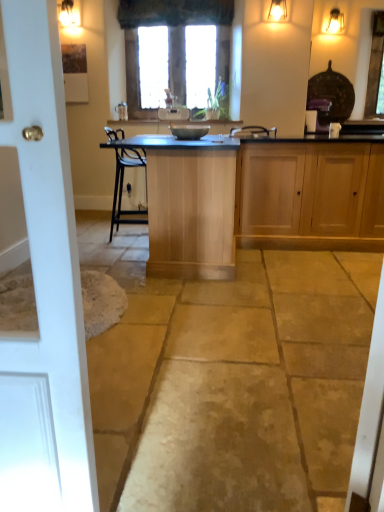
Measure the distance between point (x=340, y=31) and camera.

Point (x=340, y=31) and camera are 15.70 feet apart.

The image size is (384, 512). What do you see at coordinates (335, 22) in the screenshot? I see `matte gold light fixture at upper right` at bounding box center [335, 22].

Image resolution: width=384 pixels, height=512 pixels. What do you see at coordinates (310, 196) in the screenshot?
I see `light wood cabinet at right` at bounding box center [310, 196].

Where is `white wood door at left`? white wood door at left is located at coordinates (45, 289).

This screenshot has height=512, width=384. Describe the element at coordinates (229, 379) in the screenshot. I see `natural stone floor at center` at that location.

Identify the location of matte silver faucet at center. This screenshot has width=384, height=512. click(122, 111).

Measure the distance between point (217, 12) and camera.

The distance of point (217, 12) from camera is 5.87 meters.

Describe the element at coordinates (189, 204) in the screenshot. The height and width of the screenshot is (512, 384). I see `light wood table at center` at that location.

Find the location of a particular element. The height and width of the screenshot is (512, 384). matte gold light fixture at upper right is located at coordinates (335, 22).

Between matte silver faucet at center and light wood table at center, which one has less height?

Standing shorter between the two is matte silver faucet at center.

From the picture: Does matte silver faucet at center lie in front of light wood table at center?

No, matte silver faucet at center is behind light wood table at center.

Which object is thinner, matte silver faucet at center or light wood table at center?

With smaller width is matte silver faucet at center.

Is natural stone floor at center oriented towards light wood cabinet at right?

No, natural stone floor at center is not oriented towards light wood cabinet at right.

Which is more to the right, natural stone floor at center or light wood cabinet at right?

light wood cabinet at right.

Considering the sizes of objects natural stone floor at center and light wood cabinet at right in the image provided, who is taller, natural stone floor at center or light wood cabinet at right?

light wood cabinet at right.

In order to click on cabinetry that appears above the natural stone floor at center (from a real-world perspective) in this screenshot , I will do `click(310, 196)`.

Is white wood door at left aimed at light wood table at center?

Yes, white wood door at left is oriented towards light wood table at center.

In the image, is white wood door at left positioned in front of or behind light wood table at center?

Clearly, white wood door at left is in front of light wood table at center.

From a real-world perspective, between white wood door at left and light wood table at center, who is vertically higher?

white wood door at left is physically above.

From their relative heights in the image, would you say matte silver faucet at center is taller or shorter than natural stone floor at center?

Clearly, matte silver faucet at center is taller compared to natural stone floor at center.

From the image's perspective, which is above, matte silver faucet at center or natural stone floor at center?

matte silver faucet at center is shown above in the image.

From a real-world perspective, which object stands above the other?

matte silver faucet at center, from a real-world perspective.

You are a GUI agent. You are given a task and a screenshot of the screen. Output one action in this format:
    pyautogui.click(x=<x>, y=<y>)
    Task: Click on the faucet above the natural stone floor at center (from a real-world perspective)
    Image resolution: width=384 pixels, height=512 pixels.
    Given the screenshot: What is the action you would take?
    pyautogui.click(x=122, y=111)

Would you say matte silver faucet at center is outside matte black appliance at center?

Yes.

Could you tell me if matte silver faucet at center is facing matte black appliance at center?

No.

What are the coordinates of `faucet on the left of matte black appliance at center` in the screenshot? It's located at coord(122,111).

Would you say matte silver faucet at center is a long distance from matte black appliance at center?

Absolutely, matte silver faucet at center is distant from matte black appliance at center.

Considering the sizes of objects matte black appliance at center and white wood door at left in the image provided, who is smaller, matte black appliance at center or white wood door at left?

Smaller between the two is matte black appliance at center.

Could you tell me if matte black appliance at center is facing white wood door at left?

No, matte black appliance at center is not aimed at white wood door at left.

You are a GUI agent. You are given a task and a screenshot of the screen. Output one action in this format:
    pyautogui.click(x=<x>, y=<y>)
    Task: Click on the appliance behind the white wood door at left
    This screenshot has height=512, width=384.
    Given the screenshot: What is the action you would take?
    pyautogui.click(x=189, y=131)

Is the depth of matte black appliance at center greater than that of white wood door at left?

Yes, it is behind white wood door at left.

From the image's perspective, between white wood door at left and natural stone floor at center, which one is located above?

From the image's view, natural stone floor at center is above.

Can you confirm if white wood door at left is thinner than natural stone floor at center?

→ Indeed, white wood door at left has a lesser width compared to natural stone floor at center.

Is white wood door at left not inside natural stone floor at center?

white wood door at left lies outside natural stone floor at center's area.

Considering the relative sizes of white wood door at left and natural stone floor at center in the image provided, is white wood door at left taller than natural stone floor at center?

Indeed, white wood door at left has a greater height compared to natural stone floor at center.

You are a GUI agent. You are given a task and a screenshot of the screen. Output one action in this format:
    pyautogui.click(x=<x>, y=<y>)
    Task: Click on the faucet behind the light wood table at center
    The width and height of the screenshot is (384, 512).
    Given the screenshot: What is the action you would take?
    pyautogui.click(x=122, y=111)

You are a GUI agent. You are given a task and a screenshot of the screen. Output one action in this format:
    pyautogui.click(x=<x>, y=<y>)
    Task: Click on the cabinetry above the natural stone floor at center (from the image's perspective)
    This screenshot has height=512, width=384.
    Given the screenshot: What is the action you would take?
    pyautogui.click(x=310, y=196)

Considering their positions, is matte gold light fixture at upper right positioned closer to natural stone floor at center than matte black appliance at center?

matte black appliance at center.

When comparing their distances from matte black appliance at center, does light wood table at center or white wood door at left seem further?

white wood door at left is positioned further to the anchor matte black appliance at center.

Based on their spatial positions, is matte black appliance at center or matte gold light fixture at upper right further from light wood table at center?

matte gold light fixture at upper right is positioned further to the anchor light wood table at center.

From the image, which object appears to be nearer to natural stone floor at center, light wood table at center or matte black appliance at center?

light wood table at center is closer to natural stone floor at center.

From the image, which object appears to be farther from natural stone floor at center, light wood cabinet at right or white wood door at left?

The object further to natural stone floor at center is light wood cabinet at right.

Based on their spatial positions, is matte silver faucet at center or light wood cabinet at right further from white wood door at left?

matte silver faucet at center is further to white wood door at left.

Which object lies further to the anchor point natural stone floor at center, matte gold light fixture at upper right or matte silver faucet at center?

matte silver faucet at center is positioned further to the anchor natural stone floor at center.

When comparing their distances from matte gold light fixture at upper right, does clear glass windows at center or white wood door at left seem closer?

Based on the image, clear glass windows at center appears to be nearer to matte gold light fixture at upper right.

Identify the location of appliance that lies between matte gold light fixture at upper right and light wood table at center from top to bottom. (189, 131).

Where is `concrete between white wood door at left and clear glass windows at center in the front-back direction`? concrete between white wood door at left and clear glass windows at center in the front-back direction is located at coordinates (229, 379).

Identify the location of window between light wood table at center and matte silver faucet at center along the z-axis. This screenshot has height=512, width=384. (170, 40).

You are a GUI agent. You are given a task and a screenshot of the screen. Output one action in this format:
    pyautogui.click(x=<x>, y=<y>)
    Task: Click on the appliance located between light wood table at center and matte silver faucet at center in the depth direction
    
    Given the screenshot: What is the action you would take?
    pyautogui.click(x=189, y=131)